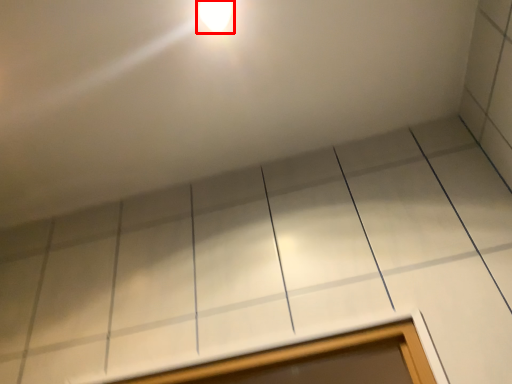
Question: From the image's perspective, what is the correct spatial positioning of light fixture (annotated by the red box) in reference to window?

Choices:
 (A) above
 (B) below

Answer: (A)